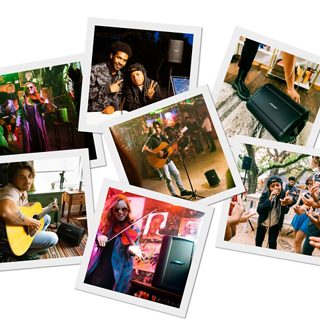
Find the location of a particular element. The height and width of the screenshot is (320, 320). photographs is located at coordinates (152, 234), (69, 191), (12, 110), (131, 66), (170, 141), (300, 80), (275, 179).